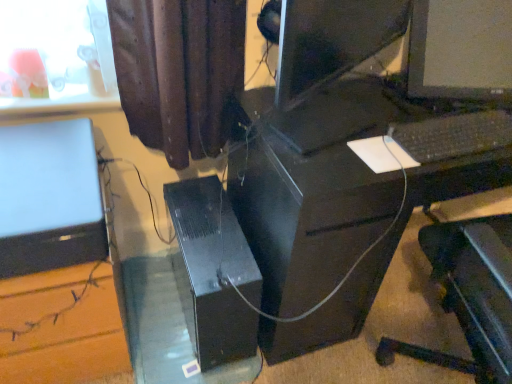
The height and width of the screenshot is (384, 512). I want to click on blank space situated above black plastic computer desk at center (from a real-world perspective), so click(390, 117).